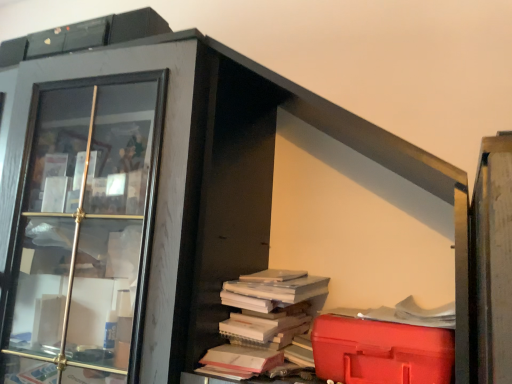
Question: Does white paper book at center touch matte glass cabinet at left?

Choices:
 (A) no
 (B) yes

Answer: (A)

Question: From a real-world perspective, is white paper book at center under matte glass cabinet at left?

Choices:
 (A) no
 (B) yes

Answer: (B)

Question: Is white paper book at center thinner than matte glass cabinet at left?

Choices:
 (A) yes
 (B) no

Answer: (A)

Question: Does white paper book at center have a smaller size compared to matte glass cabinet at left?

Choices:
 (A) yes
 (B) no

Answer: (A)

Question: Does white paper book at center have a greater height compared to matte glass cabinet at left?

Choices:
 (A) yes
 (B) no

Answer: (B)

Question: Is white paper book at center wider or thinner than matte glass cabinet at left?

Choices:
 (A) thin
 (B) wide

Answer: (A)

Question: From a real-world perspective, is white paper book at center positioned above or below matte glass cabinet at left?

Choices:
 (A) above
 (B) below

Answer: (B)

Question: In terms of height, does white paper book at center look taller or shorter compared to matte glass cabinet at left?

Choices:
 (A) short
 (B) tall

Answer: (A)

Question: Would you say white paper book at center is to the left or to the right of matte glass cabinet at left in the picture?

Choices:
 (A) right
 (B) left

Answer: (A)

Question: From a real-world perspective, is red plastic toolbox at lower right positioned above or below white paper book at center?

Choices:
 (A) below
 (B) above

Answer: (A)

Question: Is point tap(320, 362) positioned closer to the camera than point tap(252, 331)?

Choices:
 (A) closer
 (B) farther

Answer: (A)

Question: Considering the positions of red plastic toolbox at lower right and white paper book at center in the image, is red plastic toolbox at lower right wider or thinner than white paper book at center?

Choices:
 (A) wide
 (B) thin

Answer: (B)

Question: From the image's perspective, is red plastic toolbox at lower right positioned above or below white paper book at center?

Choices:
 (A) below
 (B) above

Answer: (A)

Question: From a real-world perspective, is white paper book at center physically located above or below red plastic toolbox at lower right?

Choices:
 (A) below
 (B) above

Answer: (B)

Question: From the image's perspective, is white paper book at center above or below red plastic toolbox at lower right?

Choices:
 (A) above
 (B) below

Answer: (A)